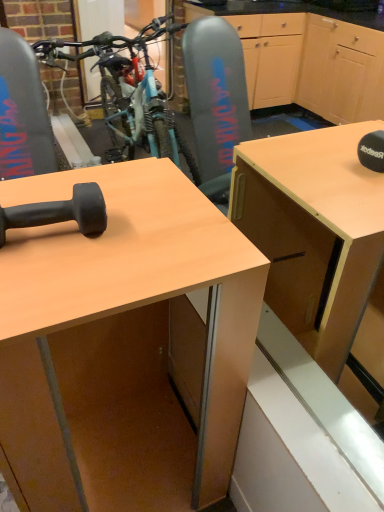
What do you see at coordinates (119, 343) in the screenshot?
I see `matte wood desk at center` at bounding box center [119, 343].

Where is `matte wood desk at center`? matte wood desk at center is located at coordinates (119, 343).

This screenshot has width=384, height=512. What do you see at coordinates (60, 212) in the screenshot?
I see `black rubber dumbbell at lower left` at bounding box center [60, 212].

Find the location of a particular element. The image size is (384, 512). black rubber dumbbell at lower left is located at coordinates (60, 212).

The height and width of the screenshot is (512, 384). Find the location of `matte wood desk at center`. matte wood desk at center is located at coordinates (119, 343).

Considering the relative positions of black rubber dumbbell at lower left and matte wood desk at center in the image provided, is black rubber dumbbell at lower left to the left of matte wood desk at center from the viewer's perspective?

Indeed, black rubber dumbbell at lower left is positioned on the left side of matte wood desk at center.

Which object is closer to the camera, black rubber dumbbell at lower left or matte wood desk at center?

matte wood desk at center is more forward.

Which is in front, point (41, 217) or point (178, 243)?

The point (41, 217) is closer.

From the image's perspective, which one is positioned higher, black rubber dumbbell at lower left or matte wood desk at center?

black rubber dumbbell at lower left.

From a real-world perspective, is black rubber dumbbell at lower left beneath matte wood desk at center?

No.

Between black rubber dumbbell at lower left and matte wood desk at center, which one has smaller width?

Thinner between the two is black rubber dumbbell at lower left.

Does black rubber dumbbell at lower left have a lesser height compared to matte wood desk at center?

Indeed, black rubber dumbbell at lower left has a lesser height compared to matte wood desk at center.

Which of these two, black rubber dumbbell at lower left or matte wood desk at center, is smaller?

Smaller between the two is black rubber dumbbell at lower left.

Could matte wood desk at center be considered to be inside black rubber dumbbell at lower left?

No, matte wood desk at center is located outside of black rubber dumbbell at lower left.

Is there a large distance between black rubber dumbbell at lower left and matte wood desk at center?

black rubber dumbbell at lower left is actually quite close to matte wood desk at center.

Could you tell me if black rubber dumbbell at lower left is facing matte wood desk at center?

No.

You are a GUI agent. You are given a task and a screenshot of the screen. Output one action in this format:
    pyautogui.click(x=<x>, y=<y>)
    Task: Click on the desk directly beneath the black rubber dumbbell at lower left (from a real-world perspective)
    
    Given the screenshot: What is the action you would take?
    pyautogui.click(x=119, y=343)

Based on their positions, is matte wood desk at center located to the left or right of black rubber dumbbell at lower left?

Based on their positions, matte wood desk at center is located to the right of black rubber dumbbell at lower left.

In the image, is matte wood desk at center positioned in front of or behind black rubber dumbbell at lower left?

matte wood desk at center is in front of black rubber dumbbell at lower left.

Which is closer, (28, 504) or (16, 224)?

Point (28, 504) is positioned farther from the camera compared to point (16, 224).

From the image's perspective, which is below, matte wood desk at center or black rubber dumbbell at lower left?

matte wood desk at center, from the image's perspective.

From a real-world perspective, which is physically below, matte wood desk at center or black rubber dumbbell at lower left?

From a 3D spatial view, matte wood desk at center is below.

Considering the sizes of matte wood desk at center and black rubber dumbbell at lower left in the image, is matte wood desk at center wider or thinner than black rubber dumbbell at lower left?

Clearly, matte wood desk at center has more width compared to black rubber dumbbell at lower left.

From their relative heights in the image, would you say matte wood desk at center is taller or shorter than black rubber dumbbell at lower left?

In the image, matte wood desk at center appears to be taller than black rubber dumbbell at lower left.

Can you confirm if matte wood desk at center is bigger than black rubber dumbbell at lower left?

Correct, matte wood desk at center is larger in size than black rubber dumbbell at lower left.

Would you say matte wood desk at center is outside black rubber dumbbell at lower left?

matte wood desk at center is positioned outside black rubber dumbbell at lower left.

Looking at this image, is the surface of matte wood desk at center in direct contact with black rubber dumbbell at lower left?

No, matte wood desk at center is not next to black rubber dumbbell at lower left.

Is black rubber dumbbell at lower left at the back of matte wood desk at center?

matte wood desk at center does not have its back to black rubber dumbbell at lower left.

How many degrees apart are the facing directions of matte wood desk at center and black rubber dumbbell at lower left?

The angle between the facing direction of matte wood desk at center and the facing direction of black rubber dumbbell at lower left is 1.64 degrees.

This screenshot has width=384, height=512. What are the coordinates of `desk in front of the black rubber dumbbell at lower left` in the screenshot? It's located at (119, 343).

In the image, there is a black rubber dumbbell at lower left. At what (x,y) coordinates should I click in order to perform the action: click on desk below it (from the image's perspective). Please return your answer as a coordinate pair (x, y). Image resolution: width=384 pixels, height=512 pixels. Looking at the image, I should click on (119, 343).

Find the location of `desk that is under the black rubber dumbbell at lower left (from a real-world perspective)`. desk that is under the black rubber dumbbell at lower left (from a real-world perspective) is located at coordinates (119, 343).